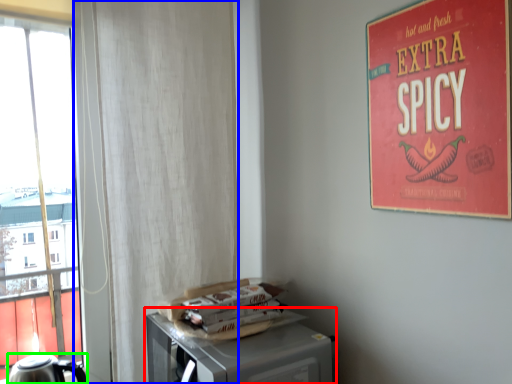
Question: Estimate the real-world distances between objects in this image. Which object is farther from table (highlighted by a red box), curtain (highlighted by a blue box) or kettle (highlighted by a green box)?

Choices:
 (A) curtain
 (B) kettle

Answer: (B)